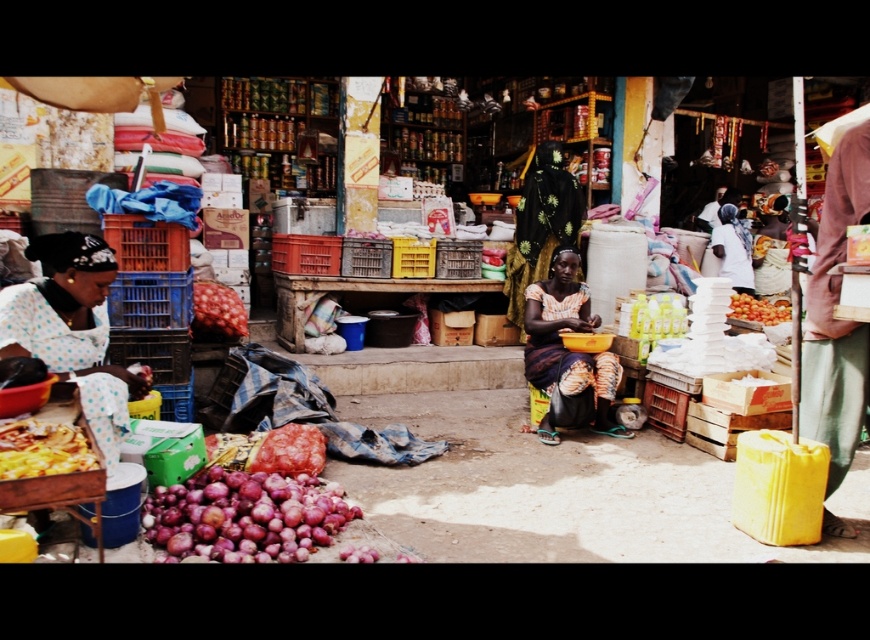
Is point (547, 362) closer to camera compared to point (47, 452)?

No, it is not.

Based on the photo, between orange printed fabric at center and golden crispy pizza at lower left, which one has less height?

golden crispy pizza at lower left is shorter.

What are the coordinates of `orange printed fabric at center` in the screenshot? It's located at (561, 340).

Consider the image. Which is more to the left, polka dot fabric at left or orange printed fabric at center?

polka dot fabric at left is more to the left.

Is polka dot fabric at left positioned at the back of orange printed fabric at center?

No, polka dot fabric at left is in front of orange printed fabric at center.

Does point (58, 356) come closer to viewer compared to point (586, 292)?

Yes, it is in front of point (586, 292).

In order to click on polka dot fabric at left in this screenshot , I will do `click(72, 328)`.

Does polka dot fabric at left appear under smooth red onion at center?

Yes.

Looking at this image, measure the distance between polka dot fabric at left and smooth red onion at center.

They are 5.40 feet apart.

You are a GUI agent. You are given a task and a screenshot of the screen. Output one action in this format:
    pyautogui.click(x=<x>, y=<y>)
    Task: Click on the polka dot fabric at left
    
    Given the screenshot: What is the action you would take?
    pyautogui.click(x=72, y=328)

The height and width of the screenshot is (640, 870). Find the location of `polka dot fabric at left`. polka dot fabric at left is located at coordinates (72, 328).